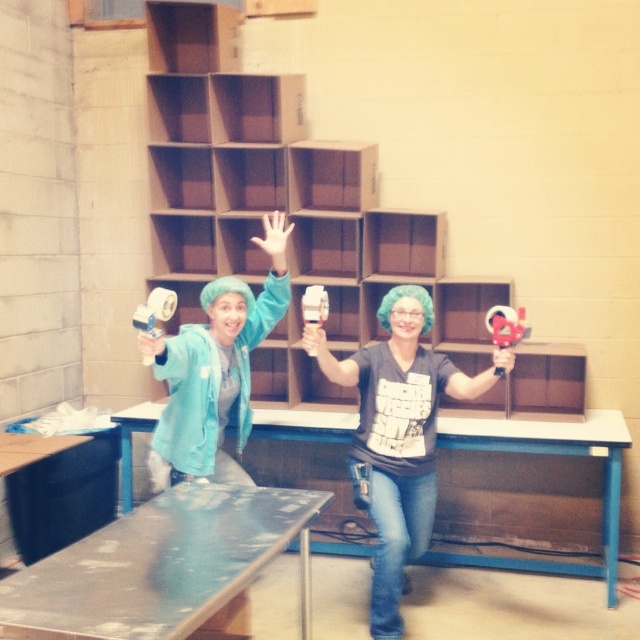
You are a delivery person who needs to place a package on the metallic silver table at lower center. The package is 36 inches long. Can you slide the matte gray shirt at center to make space?

The distance between the metallic silver table at lower center and the matte gray shirt at center is 33.05 inches. Since the package is 36 inches long, which is longer than the available space, you cannot slide the matte gray shirt at center to make enough space.

You are organizing a workshop and need to place a tool box on the metallic silver table at lower center. However, the tool box must be placed to the right of the matte gray shirt at center. Is this possible given their current positions?

The metallic silver table at lower center is positioned on the left side of the matte gray shirt at center, so placing the tool box to the right of the matte gray shirt at center would require placing it further to the right of the shirt, which may not be possible if there is no space available. However, based on the given information, the table is already to the left of the shirt, so placing the toolbox to the right of the shirt would not interfere with the table.